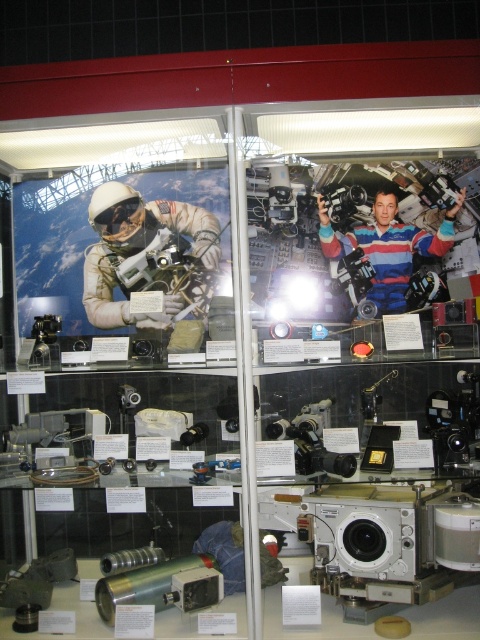
You are an astronaut preparing for a spacewalk and need to choose between the matte white spacesuit at center and the striped fabric astronaut at center displayed in the museum. Which one is bigger in size?

The matte white spacesuit at center has a larger size compared to the striped fabric astronaut at center, so the matte white spacesuit at center is bigger.

You are a museum visitor who wants to take a photo of the display case. The striped fabric astronaut at center is blocking your view of the matte white spacesuit at center. Can you adjust your position to see both objects clearly?

The matte white spacesuit at center is positioned under the striped fabric astronaut at center, so by lowering your camera angle slightly, you can capture both objects in the frame without obstruction.

You are an astronaut preparing for a spacewalk and need to choose between the matte white spacesuit at center and the striped fabric astronaut at center displayed in the museum. Which one is closer to you in the display?

The matte white spacesuit at center is closer to you in the display because it is further to the viewer than the striped fabric astronaut at center.